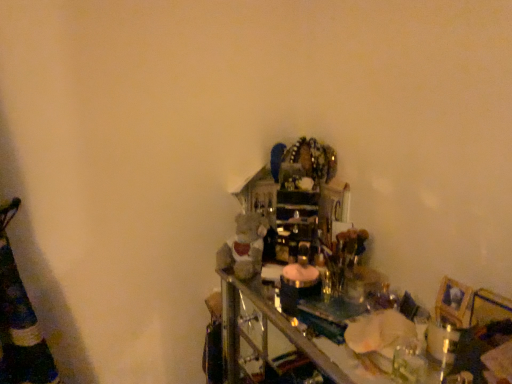
Question: Does fuzzy fabric teddy bear at center appear on the left side of wooden picture frame at lower right?

Choices:
 (A) no
 (B) yes

Answer: (B)

Question: Can you confirm if fuzzy fabric teddy bear at center is bigger than wooden picture frame at lower right?

Choices:
 (A) yes
 (B) no

Answer: (A)

Question: Is fuzzy fabric teddy bear at center wider than wooden picture frame at lower right?

Choices:
 (A) no
 (B) yes

Answer: (B)

Question: Is fuzzy fabric teddy bear at center shorter than wooden picture frame at lower right?

Choices:
 (A) no
 (B) yes

Answer: (A)

Question: Is wooden picture frame at lower right inside fuzzy fabric teddy bear at center?

Choices:
 (A) no
 (B) yes

Answer: (A)

Question: From the image's perspective, is fuzzy fabric teddy bear at center above wooden picture frame at lower right?

Choices:
 (A) no
 (B) yes

Answer: (B)

Question: From the image's perspective, is wooden picture frame at lower right under fuzzy fabric teddy bear at center?

Choices:
 (A) no
 (B) yes

Answer: (B)

Question: Considering the relative positions of wooden picture frame at lower right and fuzzy fabric teddy bear at center in the image provided, is wooden picture frame at lower right to the right of fuzzy fabric teddy bear at center from the viewer's perspective?

Choices:
 (A) yes
 (B) no

Answer: (A)

Question: Does wooden picture frame at lower right have a greater width compared to fuzzy fabric teddy bear at center?

Choices:
 (A) no
 (B) yes

Answer: (A)

Question: From a real-world perspective, is wooden picture frame at lower right positioned over fuzzy fabric teddy bear at center based on gravity?

Choices:
 (A) yes
 (B) no

Answer: (A)

Question: Considering the relative sizes of wooden picture frame at lower right and fuzzy fabric teddy bear at center in the image provided, is wooden picture frame at lower right smaller than fuzzy fabric teddy bear at center?

Choices:
 (A) no
 (B) yes

Answer: (B)

Question: Is wooden picture frame at lower right aimed at fuzzy fabric teddy bear at center?

Choices:
 (A) no
 (B) yes

Answer: (A)

Question: Considering the positions of fuzzy fabric teddy bear at center and wooden picture frame at lower right in the image, is fuzzy fabric teddy bear at center taller or shorter than wooden picture frame at lower right?

Choices:
 (A) short
 (B) tall

Answer: (B)